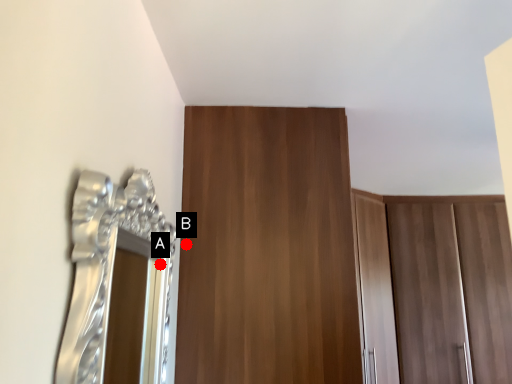
Question: Two points are circled on the image, labeled by A and B beside each circle. Which point appears farthest from the camera in this image?

Choices:
 (A) A is further
 (B) B is further

Answer: (B)